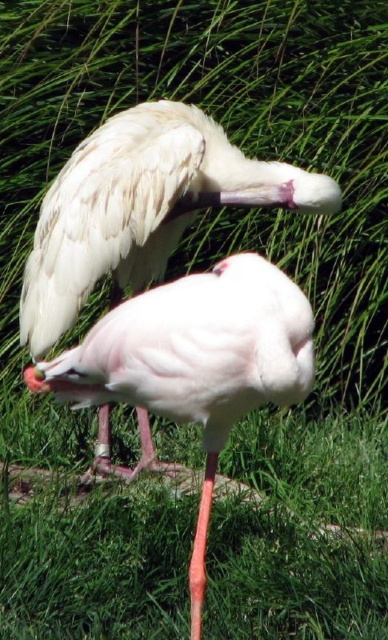
Can you confirm if smooth white bird at center is positioned above smooth pink flamingo at center?

Yes, smooth white bird at center is above smooth pink flamingo at center.

Which is behind, point (142, 449) or point (244, 275)?

The point (142, 449) is behind.

Locate an element on the screen. The height and width of the screenshot is (640, 388). smooth white bird at center is located at coordinates (142, 208).